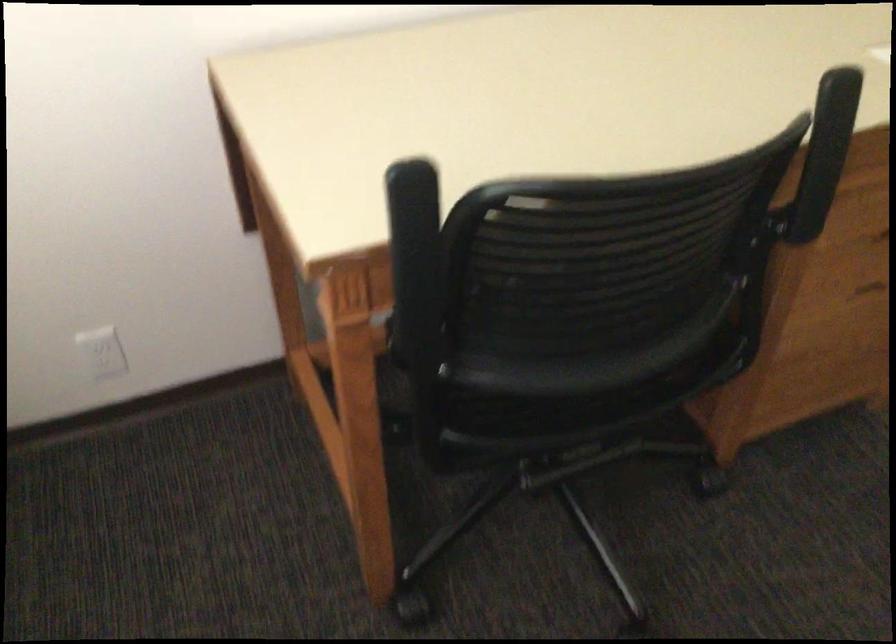
Describe the element at coordinates (572, 371) in the screenshot. I see `a chair sitting surface` at that location.